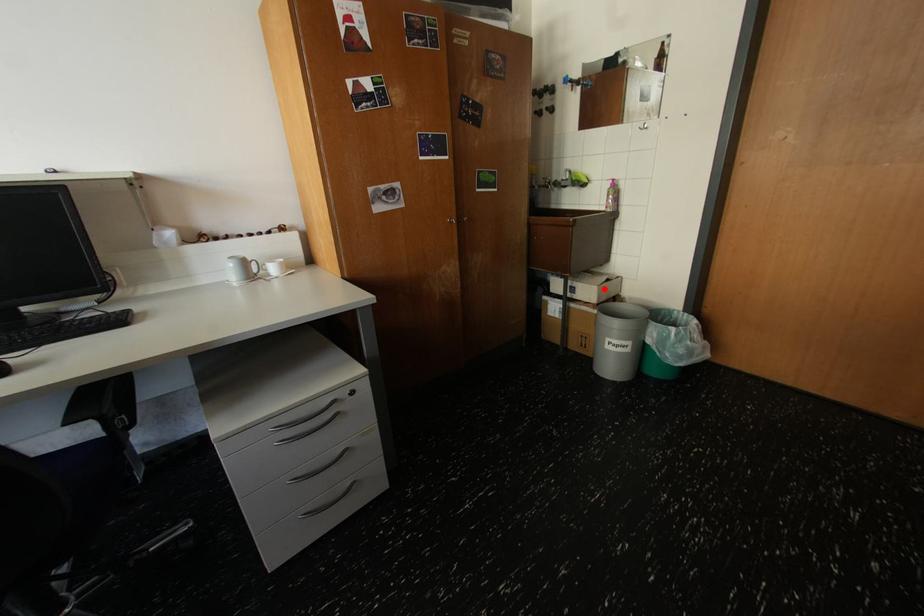
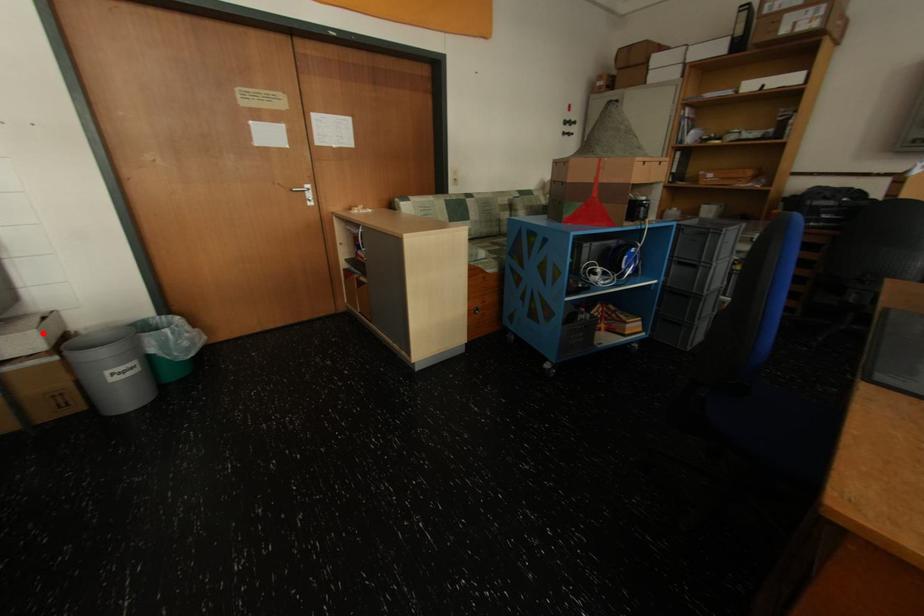
I am providing you with two images of the same scene from different viewpoints. A red point is marked on the first image and another point is marked on the second image. Does the point marked in image1 correspond to the same location as the one in image2?

Yes